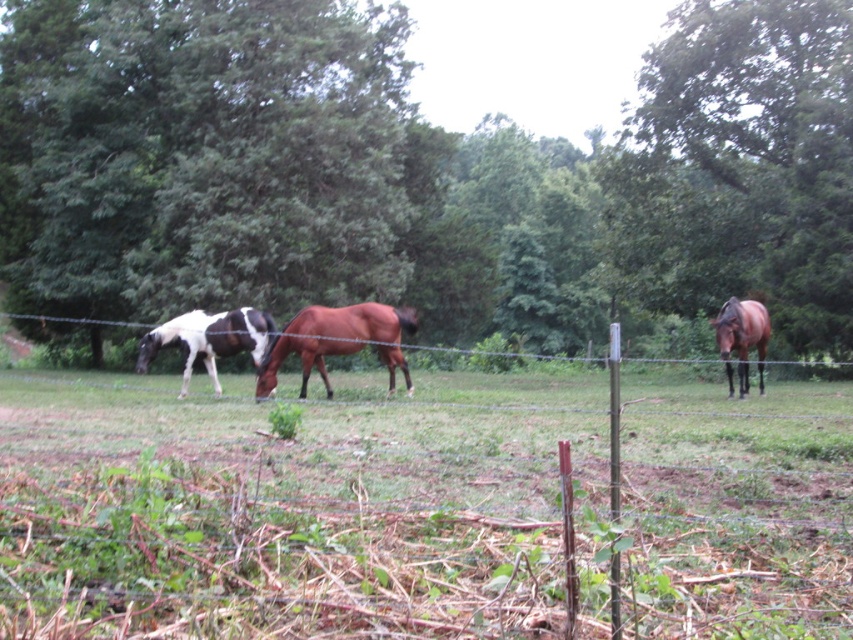
Question: Observing the image, what is the correct spatial positioning of green leafy tree at upper left in reference to brown glossy horse at right?

Choices:
 (A) left
 (B) right

Answer: (A)

Question: Among these objects, which one is farthest from the camera?

Choices:
 (A) green leafy tree at upper left
 (B) green leafy tree at upper center
 (C) white-black speckled horse at left
 (D) brown glossy horse at right

Answer: (B)

Question: Does brown glossy horse at center appear on the right side of brown glossy horse at right?

Choices:
 (A) no
 (B) yes

Answer: (A)

Question: Which object is positioned closest to the brown glossy horse at center?

Choices:
 (A) green leafy tree at upper left
 (B) brown glossy horse at right

Answer: (B)

Question: Which object appears closest to the camera in this image?

Choices:
 (A) white-black speckled horse at left
 (B) brown glossy horse at right

Answer: (B)

Question: Is the position of green leafy tree at upper center less distant than that of green leafy tree at upper right?

Choices:
 (A) yes
 (B) no

Answer: (A)